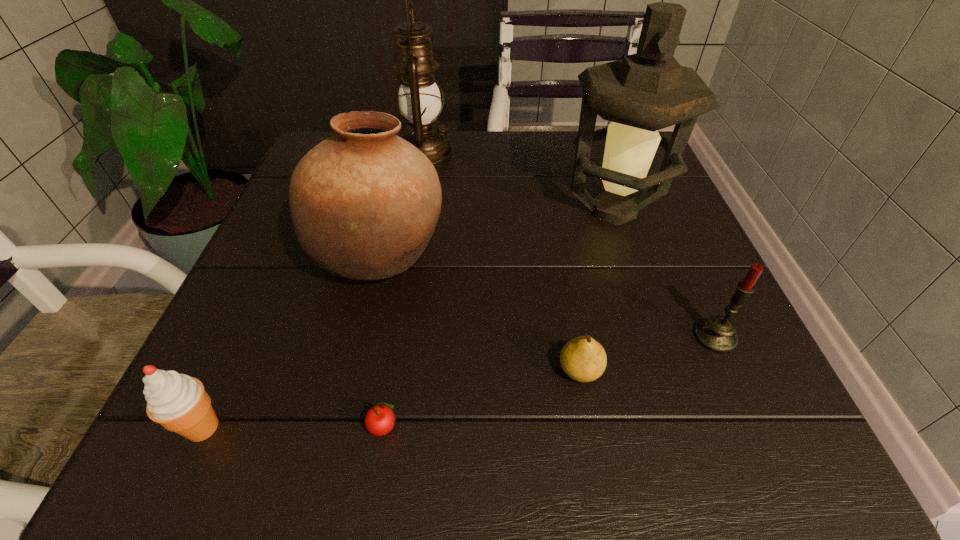
In order to click on the left oil lamp in this screenshot , I will do `click(419, 98)`.

At what (x,y) coordinates should I click in order to perform the action: click on the farthest object. Please return your answer as a coordinate pair (x, y). Looking at the image, I should click on (419, 98).

Where is `the right oil lamp`? Image resolution: width=960 pixels, height=540 pixels. the right oil lamp is located at coordinates (644, 92).

Locate an element on the screen. The height and width of the screenshot is (540, 960). pottery is located at coordinates (364, 203).

Identify the location of candle. This screenshot has width=960, height=540. (717, 334).

Locate an element on the screen. This screenshot has width=960, height=540. icecream is located at coordinates (178, 402).

Image resolution: width=960 pixels, height=540 pixels. I want to click on pear, so click(x=583, y=359).

This screenshot has height=540, width=960. I want to click on cherry, so click(x=380, y=419).

Locate an element on the screen. vacant area situated on the front of the left oil lamp is located at coordinates (413, 222).

Where is `vacant space located on the left of the nearer oil lamp`? vacant space located on the left of the nearer oil lamp is located at coordinates (470, 211).